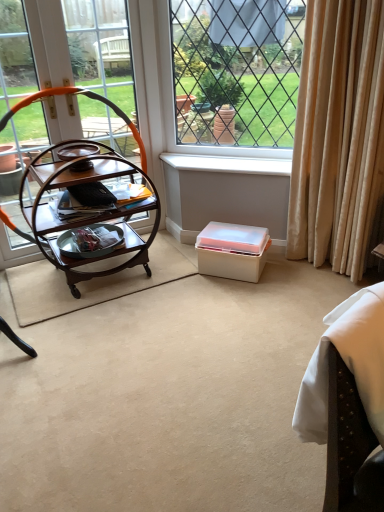
Identify the location of free space above metallic silver tray at center (from a real-world perspective). (101, 230).